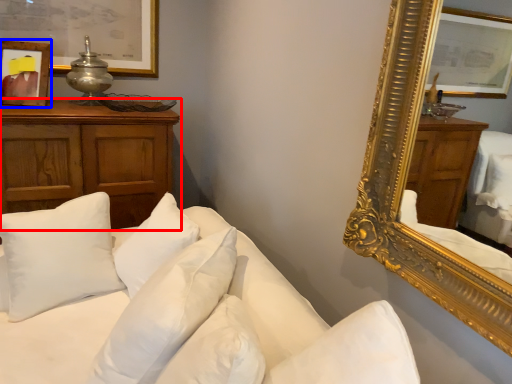
Question: Which object appears closest to the camera in this image, cabinetry (highlighted by a red box) or picture frame (highlighted by a blue box)?

Choices:
 (A) cabinetry
 (B) picture frame

Answer: (A)